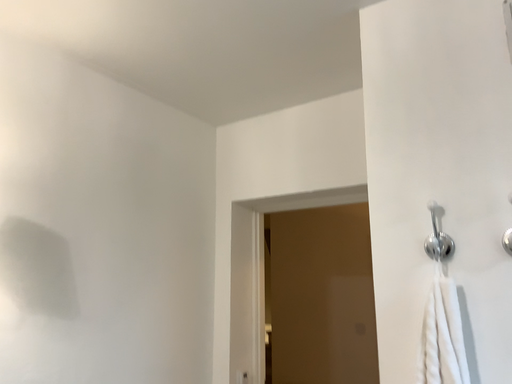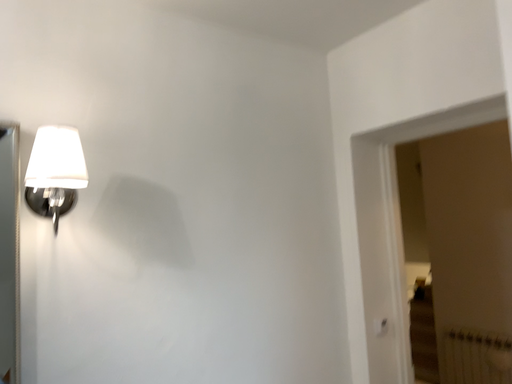
Question: Which way did the camera rotate in the video?

Choices:
 (A) rotated left
 (B) rotated right

Answer: (A)